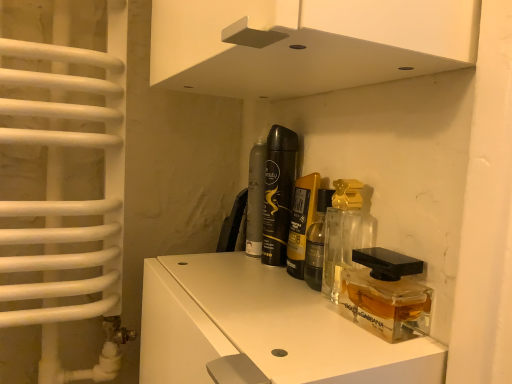
The height and width of the screenshot is (384, 512). In order to click on free space in front of clear glass perfume at center, which ranks as the 1th perfume in front-to-back order in this screenshot , I will do `click(316, 337)`.